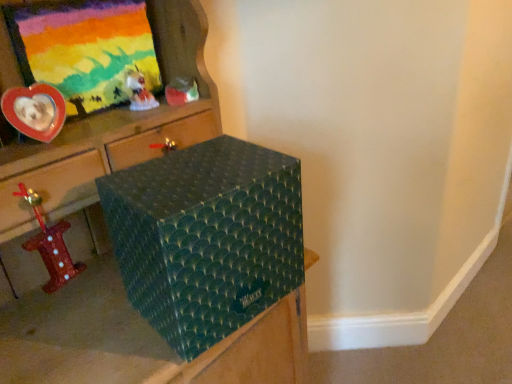
Question: Which direction should I rotate to look at matte plastic toy at upper center, placed as the first toy when sorted from back to front?

Choices:
 (A) right
 (B) left

Answer: (B)

Question: Does green textured box at center have a greater height compared to translucent plastic figurine at upper center, which is the 2th toy from bottom to top?

Choices:
 (A) yes
 (B) no

Answer: (A)

Question: From a real-world perspective, is green textured box at center physically below translucent plastic figurine at upper center, which appears as the second toy when viewed from the top?

Choices:
 (A) no
 (B) yes

Answer: (B)

Question: Could you tell me if green textured box at center is turned towards translucent plastic figurine at upper center, which appears as the second toy when viewed from the top?

Choices:
 (A) yes
 (B) no

Answer: (A)

Question: From the image's perspective, is green textured box at center under translucent plastic figurine at upper center, which is the 2th toy from bottom to top?

Choices:
 (A) no
 (B) yes

Answer: (B)

Question: Would you say green textured box at center is a long distance from translucent plastic figurine at upper center, the 2th toy positioned from the back?

Choices:
 (A) no
 (B) yes

Answer: (A)

Question: Is green textured box at center to the right of translucent plastic figurine at upper center, which appears as the 2th toy when viewed from the right, from the viewer's perspective?

Choices:
 (A) yes
 (B) no

Answer: (A)

Question: Is teal textured box at center closer to the viewer compared to metallic red number one at left, arranged as the 3th toy when viewed from the back?

Choices:
 (A) no
 (B) yes

Answer: (B)

Question: From the image's perspective, does teal textured box at center appear higher than metallic red number one at left, positioned as the 1th toy in front-to-back order?

Choices:
 (A) no
 (B) yes

Answer: (B)

Question: Is teal textured box at center touching metallic red number one at left, positioned as the 1th toy in front-to-back order?

Choices:
 (A) no
 (B) yes

Answer: (A)

Question: Is teal textured box at center oriented away from metallic red number one at left, which ranks as the 1th toy in bottom-to-top order?

Choices:
 (A) yes
 (B) no

Answer: (B)

Question: Can you confirm if teal textured box at center is shorter than metallic red number one at left, marked as the 1th toy in a left-to-right arrangement?

Choices:
 (A) no
 (B) yes

Answer: (A)

Question: Can you confirm if teal textured box at center is smaller than metallic red number one at left, which ranks as the 1th toy in bottom-to-top order?

Choices:
 (A) yes
 (B) no

Answer: (B)

Question: From a real-world perspective, does metallic red number one at left, which is counted as the third toy, starting from the top, sit lower than teal textured box at center?

Choices:
 (A) no
 (B) yes

Answer: (A)